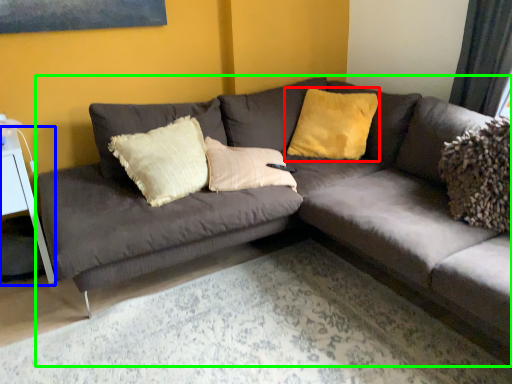
Question: Estimate the real-world distances between objects in this image. Which object is farther from pillow (highlighted by a red box), table (highlighted by a blue box) or studio couch (highlighted by a green box)?

Choices:
 (A) table
 (B) studio couch

Answer: (A)